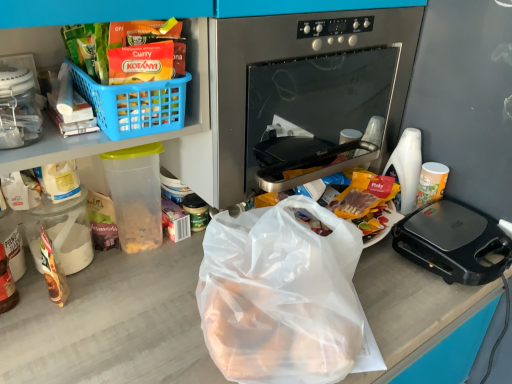
Question: From the image's perspective, would you say black plastic sandwich maker at right is positioned over stainless steel oven at center?

Choices:
 (A) yes
 (B) no

Answer: (B)

Question: Is black plastic sandwich maker at right oriented towards stainless steel oven at center?

Choices:
 (A) no
 (B) yes

Answer: (A)

Question: Considering the relative sizes of black plastic sandwich maker at right and stainless steel oven at center in the image provided, is black plastic sandwich maker at right smaller than stainless steel oven at center?

Choices:
 (A) yes
 (B) no

Answer: (A)

Question: Is there a large distance between black plastic sandwich maker at right and stainless steel oven at center?

Choices:
 (A) yes
 (B) no

Answer: (B)

Question: From the image's perspective, is black plastic sandwich maker at right below stainless steel oven at center?

Choices:
 (A) yes
 (B) no

Answer: (A)

Question: Can you confirm if black plastic sandwich maker at right is wider than stainless steel oven at center?

Choices:
 (A) no
 (B) yes

Answer: (A)

Question: Is white glossy cup at right, marked as the first coffee cup in a right-to-left arrangement, aimed at white plastic cup at right, which is the second coffee cup from right to left?

Choices:
 (A) no
 (B) yes

Answer: (A)

Question: From the image's perspective, does white glossy cup at right, which ranks as the second coffee cup in left-to-right order, appear higher than white plastic cup at right, which is the second coffee cup from right to left?

Choices:
 (A) yes
 (B) no

Answer: (B)

Question: From the image's perspective, is white glossy cup at right, marked as the first coffee cup in a right-to-left arrangement, beneath white plastic cup at right, which ranks as the 1th coffee cup in left-to-right order?

Choices:
 (A) yes
 (B) no

Answer: (A)

Question: Considering the relative sizes of white glossy cup at right, marked as the first coffee cup in a right-to-left arrangement, and white plastic cup at right, which is the second coffee cup from right to left, in the image provided, is white glossy cup at right, marked as the first coffee cup in a right-to-left arrangement, bigger than white plastic cup at right, which is the second coffee cup from right to left,?

Choices:
 (A) yes
 (B) no

Answer: (B)

Question: Can you confirm if white glossy cup at right, which ranks as the second coffee cup in left-to-right order, is shorter than white plastic cup at right, which ranks as the 1th coffee cup in left-to-right order?

Choices:
 (A) yes
 (B) no

Answer: (A)

Question: From a real-world perspective, is white glossy cup at right, which ranks as the second coffee cup in left-to-right order, below white plastic cup at right, which ranks as the 1th coffee cup in left-to-right order?

Choices:
 (A) no
 (B) yes

Answer: (B)

Question: Are blue plastic basket at upper left and stainless steel oven at center making contact?

Choices:
 (A) yes
 (B) no

Answer: (B)